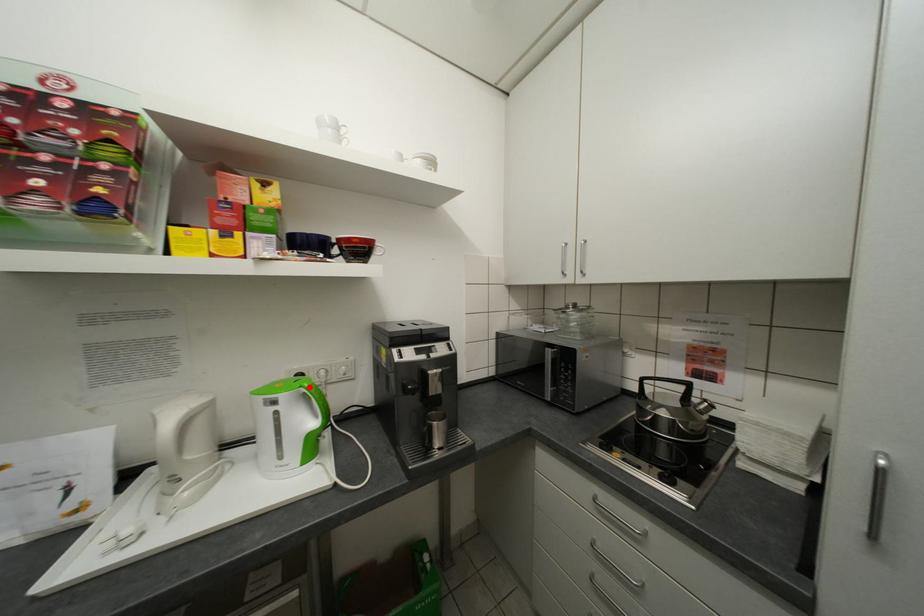
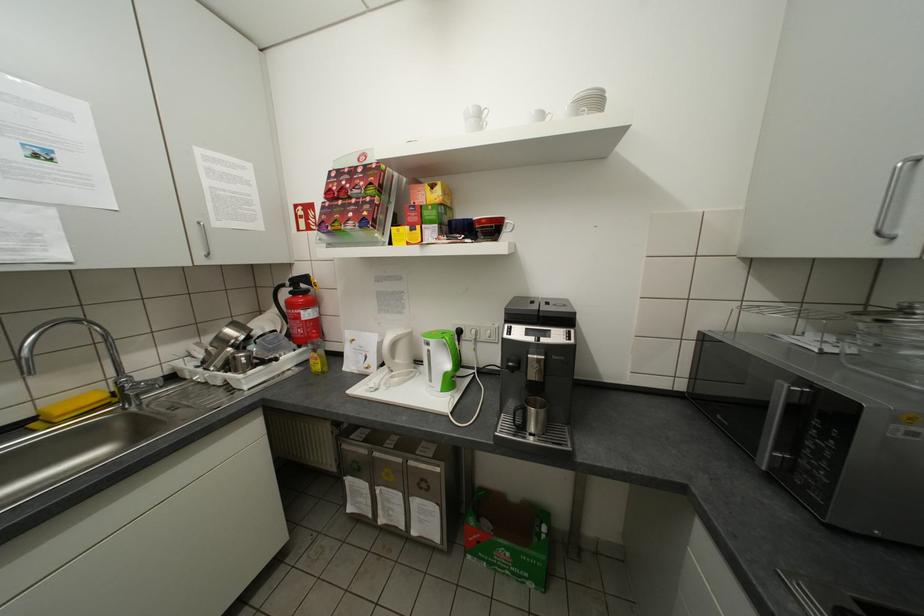
In the second image, find the point that corresponds to the highlighted location in the first image.

(452, 338)